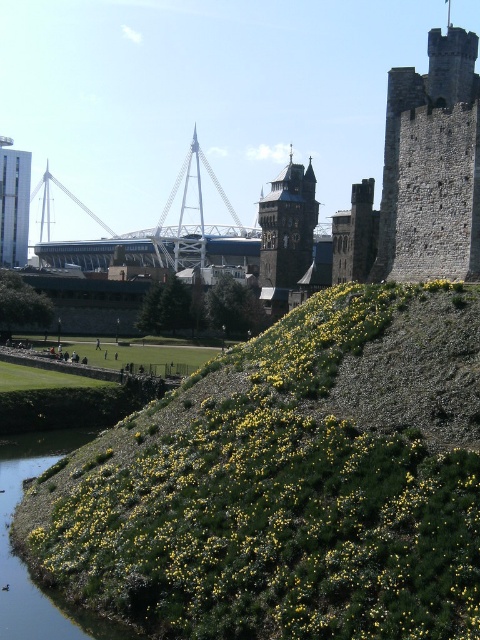
Question: Estimate the real-world distances between objects in this image. Which object is closer to the stone tower at upper right?

Choices:
 (A) green leafy shrub at lower center
 (B) smooth white tower at left
 (C) green grassy river at lower left

Answer: (A)

Question: Does green leafy shrub at lower center come in front of stone tower at upper right?

Choices:
 (A) no
 (B) yes

Answer: (B)

Question: Which point is farther to the camera?

Choices:
 (A) green leafy shrub at lower center
 (B) green grassy river at lower left
 (C) stone tower at upper right
 (D) smooth white tower at left

Answer: (D)

Question: Is green grassy river at lower left above smooth white tower at left?

Choices:
 (A) no
 (B) yes

Answer: (A)

Question: Which point appears closest to the camera in this image?

Choices:
 (A) (24, 256)
 (B) (180, 588)

Answer: (B)

Question: Is green leafy shrub at lower center above green grassy river at lower left?

Choices:
 (A) no
 (B) yes

Answer: (B)